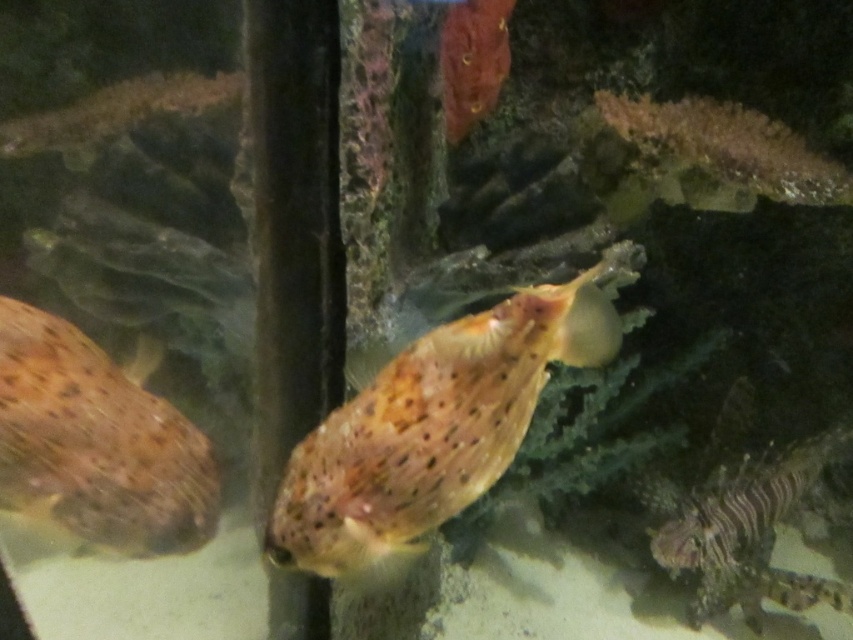
Question: Considering the relative positions of spotted orange fish at center and speckled skin at left in the image provided, where is spotted orange fish at center located with respect to speckled skin at left?

Choices:
 (A) above
 (B) below

Answer: (A)

Question: Is spotted orange fish at center in front of speckled skin at left?

Choices:
 (A) yes
 (B) no

Answer: (B)

Question: Which of the following is the farthest from the observer?

Choices:
 (A) (44, 420)
 (B) (480, 401)

Answer: (B)

Question: Which point appears closest to the camera in this image?

Choices:
 (A) (422, 388)
 (B) (155, 532)

Answer: (A)

Question: Among these objects, which one is farthest from the camera?

Choices:
 (A) spotted orange fish at center
 (B) speckled skin at left

Answer: (A)

Question: Can you confirm if spotted orange fish at center is positioned to the left of speckled skin at left?

Choices:
 (A) no
 (B) yes

Answer: (A)